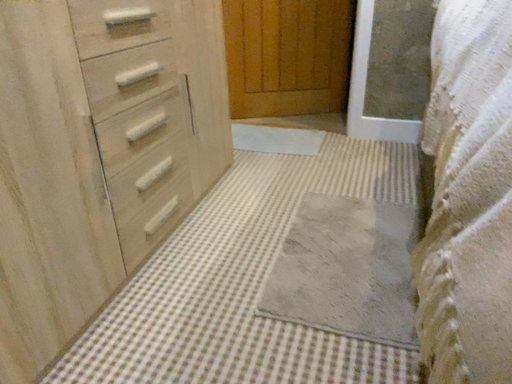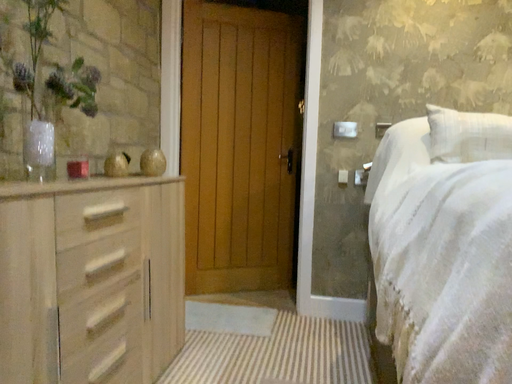
Question: Which way did the camera rotate in the video?

Choices:
 (A) rotated downward
 (B) rotated upward

Answer: (B)